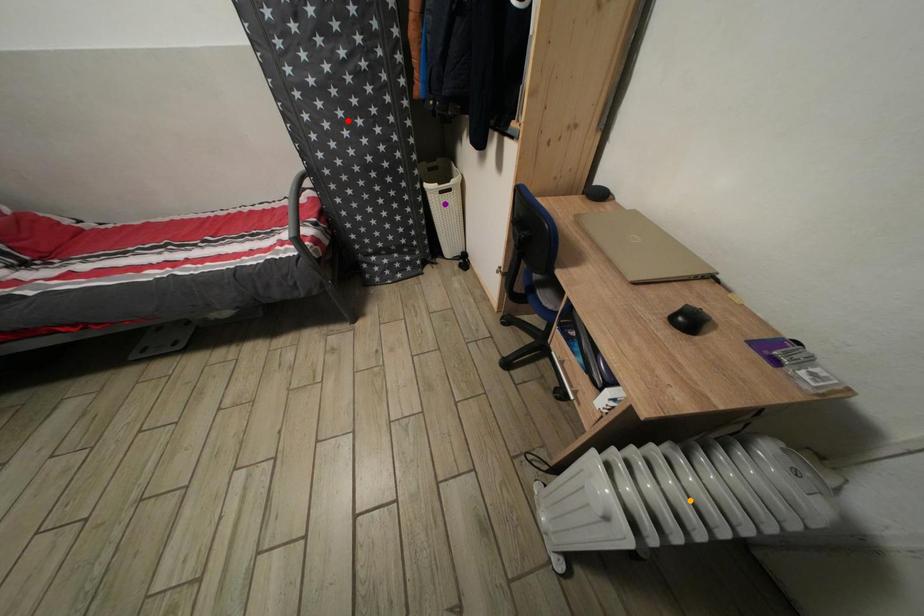
Order these from nearest to farthest:
- orange point
- purple point
- red point

orange point, red point, purple point